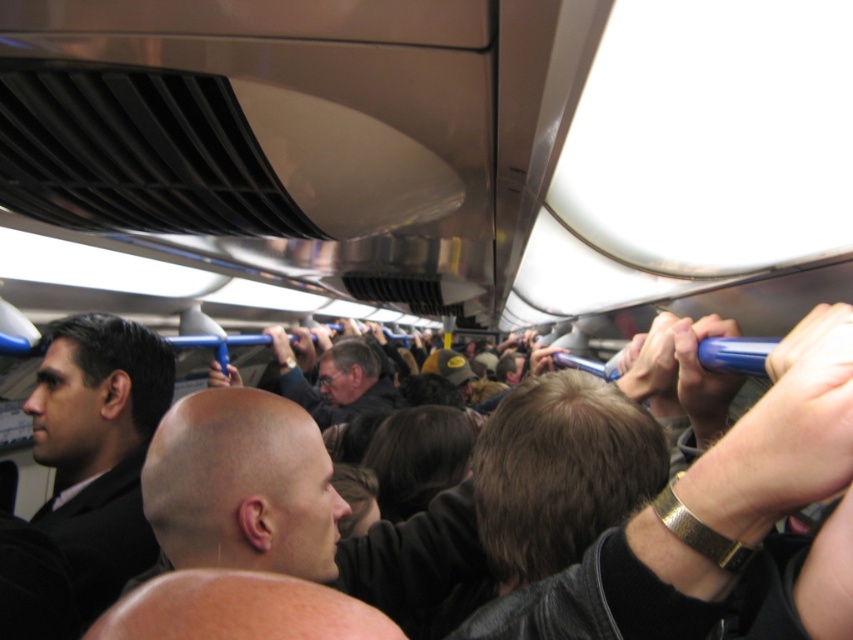
You are standing on a crowded train car and want to reach a point marked at coordinate point (271,515). If your arm can extend 30 inches, can you reach that point?

The distance between you and point (271,515) is 35.29 inches, which is farther than your arm can reach. You cannot reach it.

You are a passenger on a crowded train and you see a bald head at center and a dark gray sweater at center. Which one is shorter in height?

The bald head at center is shorter than the dark gray sweater at center because the bald head at center is not as tall as dark gray sweater at center.